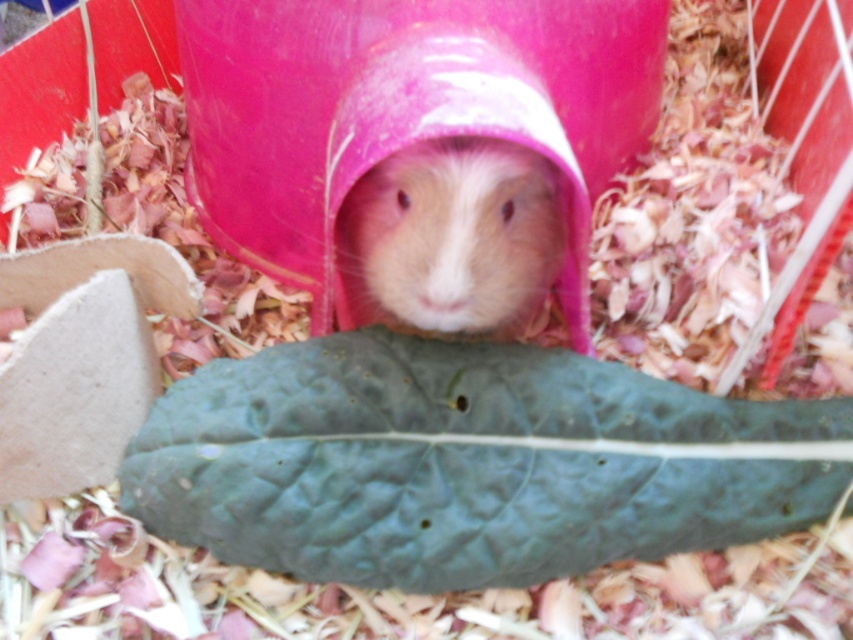
Question: Is green matte leaf at center bigger than fuzzy pink hamster at center?

Choices:
 (A) yes
 (B) no

Answer: (A)

Question: Estimate the real-world distances between objects in this image. Which object is closer to the fuzzy pink hamster at center?

Choices:
 (A) light brown fur hamster at center
 (B) green matte leaf at center

Answer: (A)

Question: Can you confirm if green matte leaf at center is smaller than fuzzy pink hamster at center?

Choices:
 (A) yes
 (B) no

Answer: (B)

Question: Estimate the real-world distances between objects in this image. Which object is farther from the fuzzy pink hamster at center?

Choices:
 (A) light brown fur hamster at center
 (B) green matte leaf at center

Answer: (B)

Question: Which object is the farthest from the green matte leaf at center?

Choices:
 (A) light brown fur hamster at center
 (B) fuzzy pink hamster at center

Answer: (A)

Question: Is light brown fur hamster at center further to the viewer compared to fuzzy pink hamster at center?

Choices:
 (A) yes
 (B) no

Answer: (B)